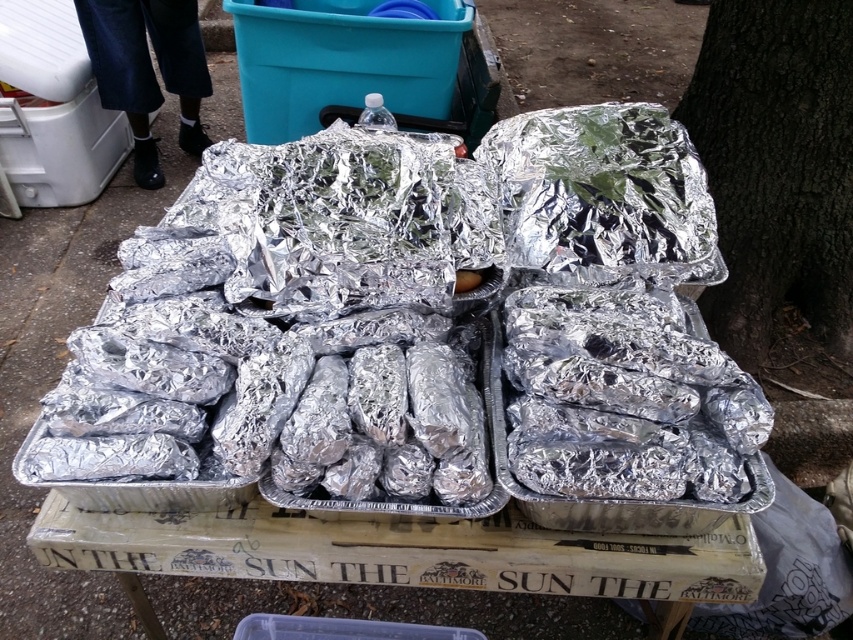
Question: Can you confirm if shiny metallic trays at center is positioned above dark brown textured bark at right?

Choices:
 (A) no
 (B) yes

Answer: (A)

Question: Does shiny metallic trays at center have a smaller size compared to dark brown textured bark at right?

Choices:
 (A) yes
 (B) no

Answer: (B)

Question: Among these objects, which one is farthest from the camera?

Choices:
 (A) shiny metallic trays at center
 (B) dark brown textured bark at right

Answer: (B)

Question: Is shiny metallic trays at center positioned before dark brown textured bark at right?

Choices:
 (A) yes
 (B) no

Answer: (A)

Question: Among these points, which one is nearest to the camera?

Choices:
 (A) (720, 372)
 (B) (822, 16)

Answer: (A)